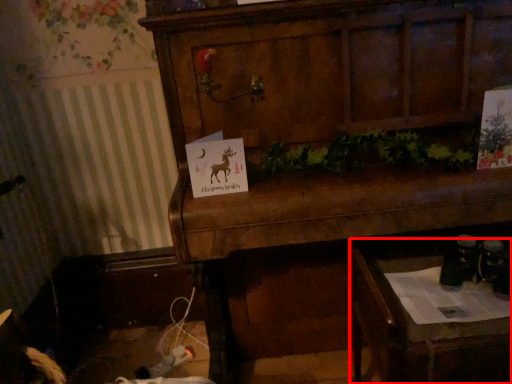
Question: From the image's perspective, where is table (annotated by the red box) located in relation to furniture in the image?

Choices:
 (A) above
 (B) below

Answer: (B)